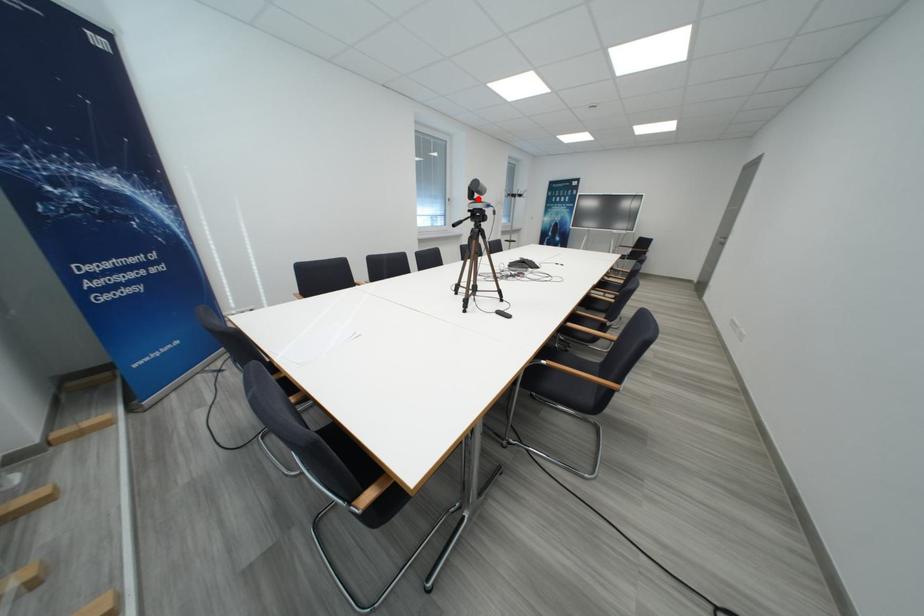
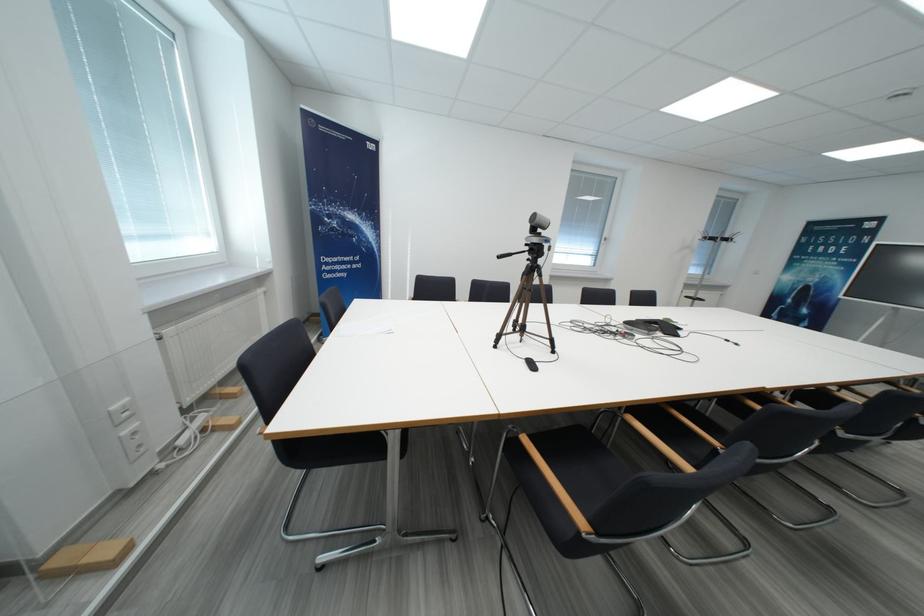
In the second image, find the point that corresponds to the highlighted location in the first image.

(541, 233)